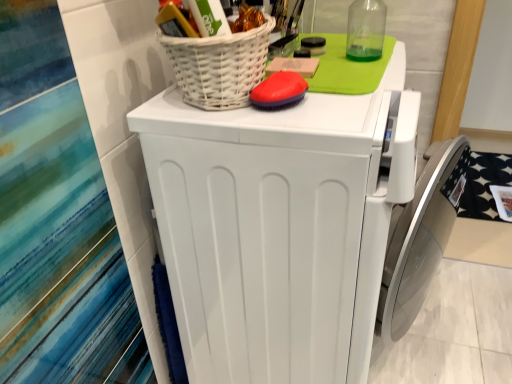
Question: Considering the relative sizes of white wicker basket at upper center and red rubber brush at upper center in the image provided, is white wicker basket at upper center taller than red rubber brush at upper center?

Choices:
 (A) yes
 (B) no

Answer: (A)

Question: Is white wicker basket at upper center touching red rubber brush at upper center?

Choices:
 (A) no
 (B) yes

Answer: (B)

Question: Is white wicker basket at upper center thinner than red rubber brush at upper center?

Choices:
 (A) yes
 (B) no

Answer: (B)

Question: Is white wicker basket at upper center turned away from red rubber brush at upper center?

Choices:
 (A) no
 (B) yes

Answer: (A)

Question: Is white wicker basket at upper center behind red rubber brush at upper center?

Choices:
 (A) yes
 (B) no

Answer: (B)

Question: Is white wicker basket at upper center bigger or smaller than white matte washing machine at center?

Choices:
 (A) small
 (B) big

Answer: (A)

Question: Choose the correct answer: Is white wicker basket at upper center inside white matte washing machine at center or outside it?

Choices:
 (A) outside
 (B) inside

Answer: (A)

Question: Would you say white wicker basket at upper center is to the left or to the right of white matte washing machine at center in the picture?

Choices:
 (A) right
 (B) left

Answer: (B)

Question: Relative to white matte washing machine at center, is white wicker basket at upper center in front or behind?

Choices:
 (A) behind
 (B) front

Answer: (A)

Question: Based on their positions, is white matte washing machine at center located to the left or right of white wicker basket at upper center?

Choices:
 (A) left
 (B) right

Answer: (B)

Question: From the image's perspective, is white matte washing machine at center located above or below white wicker basket at upper center?

Choices:
 (A) above
 (B) below

Answer: (B)

Question: Would you say white matte washing machine at center is inside or outside white wicker basket at upper center?

Choices:
 (A) inside
 (B) outside

Answer: (B)

Question: Considering the positions of point (302, 316) and point (185, 100), is point (302, 316) closer or farther from the camera than point (185, 100)?

Choices:
 (A) closer
 (B) farther

Answer: (B)

Question: Looking at their shapes, would you say red rubber brush at upper center is wider or thinner than white wicker basket at upper center?

Choices:
 (A) thin
 (B) wide

Answer: (A)

Question: In the image, is red rubber brush at upper center positioned in front of or behind white wicker basket at upper center?

Choices:
 (A) behind
 (B) front

Answer: (A)